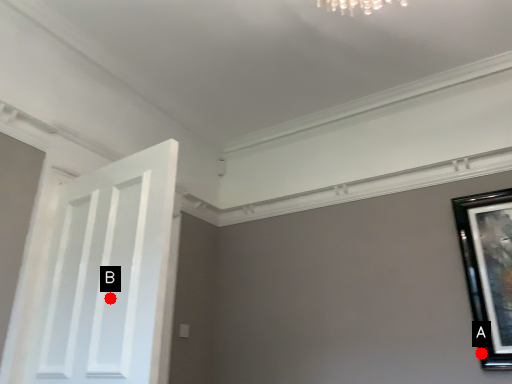
Question: Two points are circled on the image, labeled by A and B beside each circle. Which point is farther to the camera?

Choices:
 (A) A is further
 (B) B is further

Answer: (A)